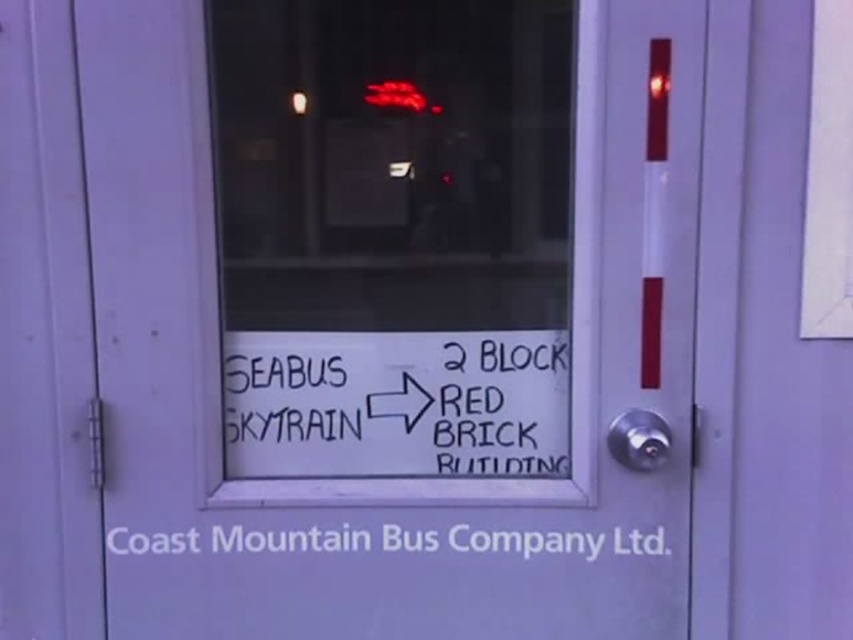
Is white paper sign at center shorter than black marker sign at center?

In fact, white paper sign at center may be taller than black marker sign at center.

Locate an element on the screen. The height and width of the screenshot is (640, 853). white paper sign at center is located at coordinates (407, 250).

Locate an element on the screen. The height and width of the screenshot is (640, 853). white paper sign at center is located at coordinates (407, 250).

Is point (440, 248) positioned in front of point (164, 541)?

No, it is behind (164, 541).

Is transparent glass door at center positioned at the back of white paper at center?

No, transparent glass door at center is in front of white paper at center.

The image size is (853, 640). In order to click on transparent glass door at center in this screenshot , I will do `click(393, 314)`.

At what (x,y) coordinates should I click in order to perform the action: click on transparent glass door at center. Please return your answer as a coordinate pair (x, y). The image size is (853, 640). Looking at the image, I should click on (393, 314).

Who is shorter, transparent glass door at center or black marker sign at center?

black marker sign at center

Is transparent glass door at center wider than black marker sign at center?

Correct, the width of transparent glass door at center exceeds that of black marker sign at center.

Locate an element on the screen. Image resolution: width=853 pixels, height=640 pixels. transparent glass door at center is located at coordinates (393, 314).

The width and height of the screenshot is (853, 640). I want to click on transparent glass door at center, so click(393, 314).